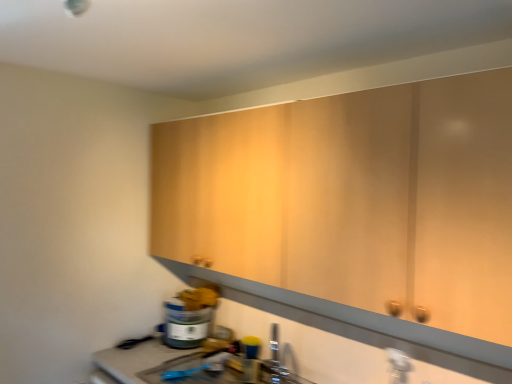
Where is `blank space situated above matte plastic container at lower left (from a real-world perspective)`? This screenshot has height=384, width=512. blank space situated above matte plastic container at lower left (from a real-world perspective) is located at coordinates (189, 307).